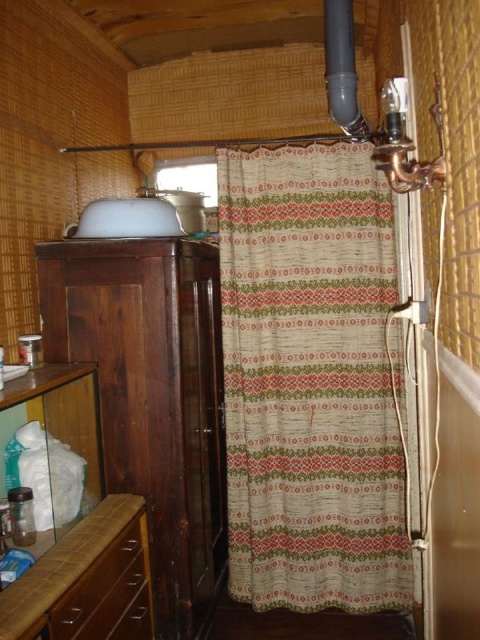
Does patterned fabric shower curtain at center have a smaller size compared to brown wood drawer at lower left?

No.

Locate an element on the screen. The width and height of the screenshot is (480, 640). patterned fabric shower curtain at center is located at coordinates (311, 380).

Between point (370, 268) and point (139, 550), which one is positioned behind?

The point (370, 268) is behind.

The height and width of the screenshot is (640, 480). I want to click on patterned fabric shower curtain at center, so point(311,380).